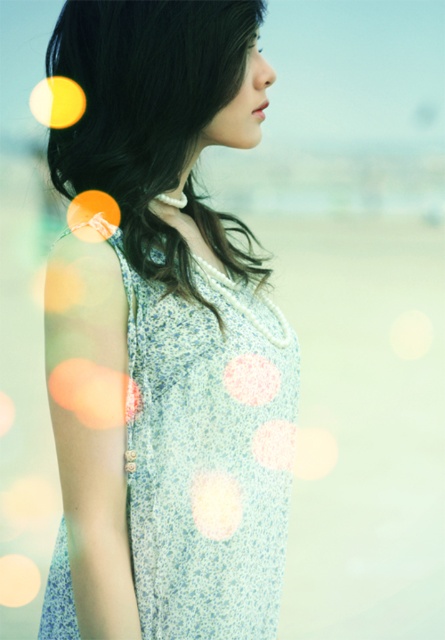
Question: Is dark brown silky hair at upper left positioned in front of white dotted fabric at center?

Choices:
 (A) yes
 (B) no

Answer: (A)

Question: Where is dark brown silky hair at upper left located in relation to pink fabric polka dot at center in the image?

Choices:
 (A) right
 (B) left

Answer: (B)

Question: Which point is closer to the camera taking this photo?

Choices:
 (A) (148, 518)
 (B) (274, 429)

Answer: (A)

Question: Considering the real-world distances, which object is farthest from the white textured fabric at center?

Choices:
 (A) light blue floral dress at center
 (B) pink fabric polka dot at center
 (C) white dotted fabric at center

Answer: (A)

Question: Considering the real-world distances, which object is farthest from the white dotted fabric at center?

Choices:
 (A) dark brown silky hair at upper left
 (B) pink fabric polka dot at center
 (C) white textured fabric at center
 (D) light blue floral dress at center

Answer: (A)

Question: Can you confirm if light blue floral dress at center is bigger than dark brown silky hair at upper left?

Choices:
 (A) yes
 (B) no

Answer: (A)